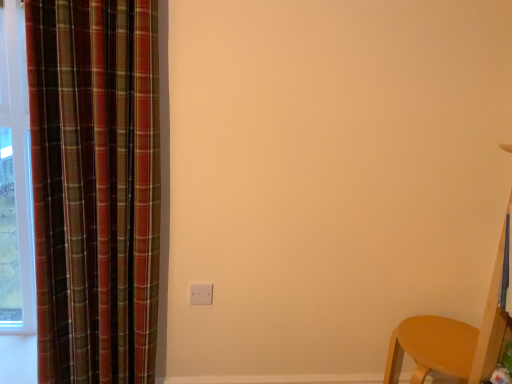
You are a GUI agent. You are given a task and a screenshot of the screen. Output one action in this format:
    pyautogui.click(x=<x>, y=<y>)
    Task: Click on the white matte electric outlet at center
    
    Given the screenshot: What is the action you would take?
    pyautogui.click(x=201, y=294)

What do you see at coordinates (95, 187) in the screenshot? This screenshot has height=384, width=512. I see `plaid fabric curtain at left` at bounding box center [95, 187].

Find the location of a particular element. matte wood chair at lower right is located at coordinates (443, 348).

Between plaid fabric curtain at left and matte wood chair at lower right, which one is positioned behind?

matte wood chair at lower right is behind.

Are plaid fabric curtain at left and matte wood chair at lower right beside each other?

No, plaid fabric curtain at left is not beside matte wood chair at lower right.

At what (x,y) coordinates should I click in order to perform the action: click on curtain above the matte wood chair at lower right (from the image's perspective). Please return your answer as a coordinate pair (x, y). The height and width of the screenshot is (384, 512). Looking at the image, I should click on (95, 187).

From the image's perspective, between plaid fabric curtain at left and matte wood chair at lower right, who is located below?

From the image's view, matte wood chair at lower right is below.

Which object is positioned more to the right, white matte electric outlet at center or matte wood chair at lower right?

matte wood chair at lower right.

Is white matte electric outlet at center closer to camera compared to matte wood chair at lower right?

No, white matte electric outlet at center is behind matte wood chair at lower right.

I want to click on electric outlet behind the matte wood chair at lower right, so click(201, 294).

Considering the relative sizes of white matte electric outlet at center and matte wood chair at lower right in the image provided, is white matte electric outlet at center shorter than matte wood chair at lower right?

Indeed, white matte electric outlet at center has a lesser height compared to matte wood chair at lower right.

Is white matte electric outlet at center outside of plaid fabric curtain at left?

white matte electric outlet at center lies outside plaid fabric curtain at left's area.

Considering their positions, is white matte electric outlet at center located in front of or behind plaid fabric curtain at left?

white matte electric outlet at center is positioned farther from the viewer than plaid fabric curtain at left.

Which object is wider, white matte electric outlet at center or plaid fabric curtain at left?

plaid fabric curtain at left is wider.

From the image's perspective, which is above, white matte electric outlet at center or plaid fabric curtain at left?

plaid fabric curtain at left, from the image's perspective.

Considering the sizes of objects plaid fabric curtain at left and white matte electric outlet at center in the image provided, who is bigger, plaid fabric curtain at left or white matte electric outlet at center?

Bigger between the two is plaid fabric curtain at left.

Considering the sizes of plaid fabric curtain at left and white matte electric outlet at center in the image, is plaid fabric curtain at left wider or thinner than white matte electric outlet at center?

plaid fabric curtain at left is wider than white matte electric outlet at center.

Does point (44, 306) appear closer or farther from the camera than point (205, 299)?

Point (44, 306) is closer to the camera than point (205, 299).

Choose the correct answer: Is plaid fabric curtain at left inside white matte electric outlet at center or outside it?

plaid fabric curtain at left exists outside the volume of white matte electric outlet at center.

Visually, is matte wood chair at lower right positioned to the left or to the right of plaid fabric curtain at left?

matte wood chair at lower right is positioned on plaid fabric curtain at left's right side.

Considering the points (477, 340) and (154, 56), which point is behind, point (477, 340) or point (154, 56)?

Positioned behind is point (477, 340).

Is plaid fabric curtain at left at the back of matte wood chair at lower right?

No, matte wood chair at lower right is not facing the opposite direction of plaid fabric curtain at left.

What's the angular difference between matte wood chair at lower right and white matte electric outlet at center's facing directions?

The angular difference between matte wood chair at lower right and white matte electric outlet at center is 87.9 degrees.

Can you confirm if matte wood chair at lower right is smaller than white matte electric outlet at center?

No, matte wood chair at lower right is not smaller than white matte electric outlet at center.

Which object is further away from the camera, matte wood chair at lower right or white matte electric outlet at center?

white matte electric outlet at center.

Which is closer to the camera, [395,347] or [192,293]?

Point [192,293]

Where is `furniture below the plaid fabric curtain at left (from the image's perspective)`? This screenshot has width=512, height=384. furniture below the plaid fabric curtain at left (from the image's perspective) is located at coordinates (443, 348).

The image size is (512, 384). Identify the location of electric outlet lying on the left of matte wood chair at lower right. (201, 294).

Which object lies nearer to the anchor point white matte electric outlet at center, plaid fabric curtain at left or matte wood chair at lower right?

plaid fabric curtain at left lies closer to white matte electric outlet at center than the other object.

Which object lies nearer to the anchor point plaid fabric curtain at left, matte wood chair at lower right or white matte electric outlet at center?

white matte electric outlet at center is closer to plaid fabric curtain at left.

From the image, which object appears to be nearer to matte wood chair at lower right, white matte electric outlet at center or plaid fabric curtain at left?

white matte electric outlet at center lies closer to matte wood chair at lower right than the other object.

Which object lies nearer to the anchor point plaid fabric curtain at left, white matte electric outlet at center or matte wood chair at lower right?

Based on the image, white matte electric outlet at center appears to be nearer to plaid fabric curtain at left.

Estimate the real-world distances between objects in this image. Which object is further from matte wood chair at lower right, plaid fabric curtain at left or white matte electric outlet at center?

plaid fabric curtain at left lies further to matte wood chair at lower right than the other object.

Considering their positions, is matte wood chair at lower right positioned further to white matte electric outlet at center than plaid fabric curtain at left?

matte wood chair at lower right lies further to white matte electric outlet at center than the other object.

The width and height of the screenshot is (512, 384). I want to click on electric outlet located between plaid fabric curtain at left and matte wood chair at lower right in the left-right direction, so click(x=201, y=294).